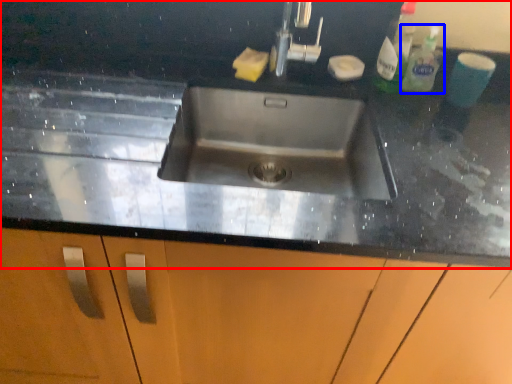
Question: Among these objects, which one is farthest to the camera, countertop (highlighted by a red box) or cleaning product (highlighted by a blue box)?

Choices:
 (A) countertop
 (B) cleaning product

Answer: (B)